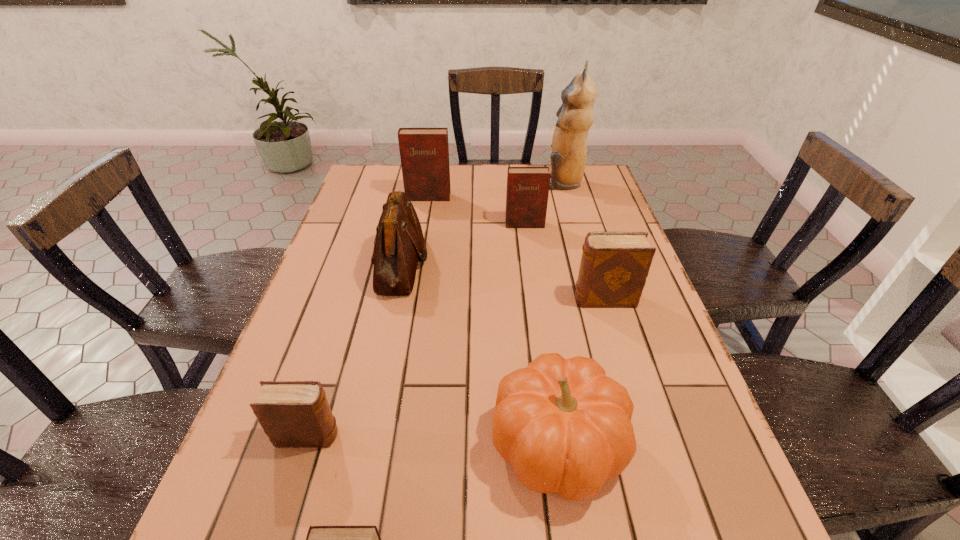
Identify the location of vacant space situated 0.350m on the spine side of the third nearest diary. (431, 299).

The image size is (960, 540). Identify the location of vacant space located on the left of the orange pumpkin. (286, 442).

Locate an element on the screen. The image size is (960, 540). free location located 0.210m on the spine side of the leftmost diary is located at coordinates (453, 436).

Find the location of `cat that is at the far edge`. cat that is at the far edge is located at coordinates (575, 116).

This screenshot has width=960, height=540. I want to click on diary at the far edge, so click(424, 152).

At what (x,y) coordinates should I click in order to perform the action: click on shoulder bag positioned at the left edge. Please return your answer as a coordinate pair (x, y). Image resolution: width=960 pixels, height=540 pixels. Looking at the image, I should click on click(x=399, y=241).

Find the location of `diary that is at the left edge`. diary that is at the left edge is located at coordinates [x=295, y=414].

Locate an element on the screen. The width and height of the screenshot is (960, 540). cat that is at the right edge is located at coordinates coord(575,116).

Locate an element on the screen. This screenshot has width=960, height=540. diary at the right edge is located at coordinates (614, 266).

Locate an element on the screen. The image size is (960, 540). object at the far right corner is located at coordinates (575, 116).